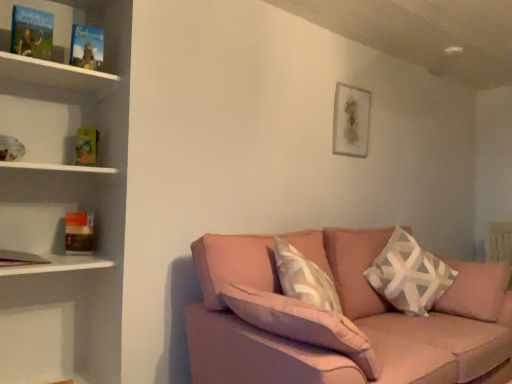
Question: Considering the relative sizes of white wooden shelf at left and hardcover book at upper left, positioned as the fourth paperback book in back-to-front order, in the image provided, is white wooden shelf at left smaller than hardcover book at upper left, positioned as the fourth paperback book in back-to-front order,?

Choices:
 (A) yes
 (B) no

Answer: (B)

Question: From a real-world perspective, is white wooden shelf at left on top of hardcover book at upper left, positioned as the fourth paperback book in back-to-front order?

Choices:
 (A) no
 (B) yes

Answer: (A)

Question: Considering the relative positions of white wooden shelf at left and hardcover book at upper left, placed as the 1th paperback book when sorted from top to bottom, in the image provided, is white wooden shelf at left in front of hardcover book at upper left, placed as the 1th paperback book when sorted from top to bottom,?

Choices:
 (A) yes
 (B) no

Answer: (A)

Question: Is white wooden shelf at left further to the viewer compared to hardcover book at upper left, which ranks as the first paperback book in front-to-back order?

Choices:
 (A) no
 (B) yes

Answer: (A)

Question: Is white wooden shelf at left next to hardcover book at upper left, arranged as the 4th paperback book when ordered from the bottom, and touching it?

Choices:
 (A) yes
 (B) no

Answer: (B)

Question: Is white wooden shelf at left taller than hardcover book at upper left, arranged as the 4th paperback book when ordered from the bottom?

Choices:
 (A) no
 (B) yes

Answer: (A)

Question: Is yellow paper at left, the 2th paperback book when ordered from bottom to top, at the left side of hardcover book at upper left, arranged as the 4th paperback book when ordered from the bottom?

Choices:
 (A) no
 (B) yes

Answer: (A)

Question: From the image's perspective, is yellow paper at left, positioned as the fourth paperback book in front-to-back order, over hardcover book at upper left, arranged as the 4th paperback book when ordered from the bottom?

Choices:
 (A) yes
 (B) no

Answer: (B)

Question: Is yellow paper at left, positioned as the fourth paperback book in front-to-back order, not close to hardcover book at upper left, placed as the 1th paperback book when sorted from top to bottom?

Choices:
 (A) no
 (B) yes

Answer: (A)

Question: Does yellow paper at left, positioned as the fourth paperback book in front-to-back order, lie in front of hardcover book at upper left, which ranks as the first paperback book in front-to-back order?

Choices:
 (A) no
 (B) yes

Answer: (A)

Question: Does yellow paper at left, which is counted as the third paperback book, starting from the top, have a lesser height compared to hardcover book at upper left, arranged as the 4th paperback book when ordered from the bottom?

Choices:
 (A) no
 (B) yes

Answer: (B)

Question: Could you tell me if yellow paper at left, the 1th paperback book in the back-to-front sequence, is facing hardcover book at upper left, positioned as the fourth paperback book in back-to-front order?

Choices:
 (A) yes
 (B) no

Answer: (B)

Question: Does yellow paper at left, the 1th paperback book in the back-to-front sequence, lie in front of hardcover book at left, which is the 2th paperback book from back to front?

Choices:
 (A) yes
 (B) no

Answer: (B)